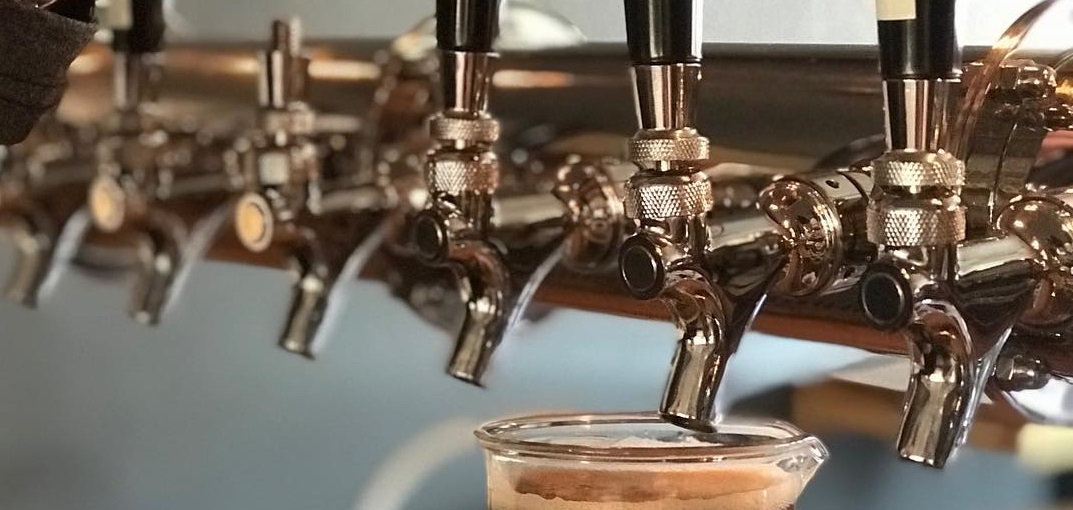
At what (x,y) coordinates should I click in order to perform the action: click on glass cup. Please return your answer as a coordinate pair (x, y). The image size is (1073, 510). Looking at the image, I should click on (661, 467), (562, 461), (553, 442), (710, 458).